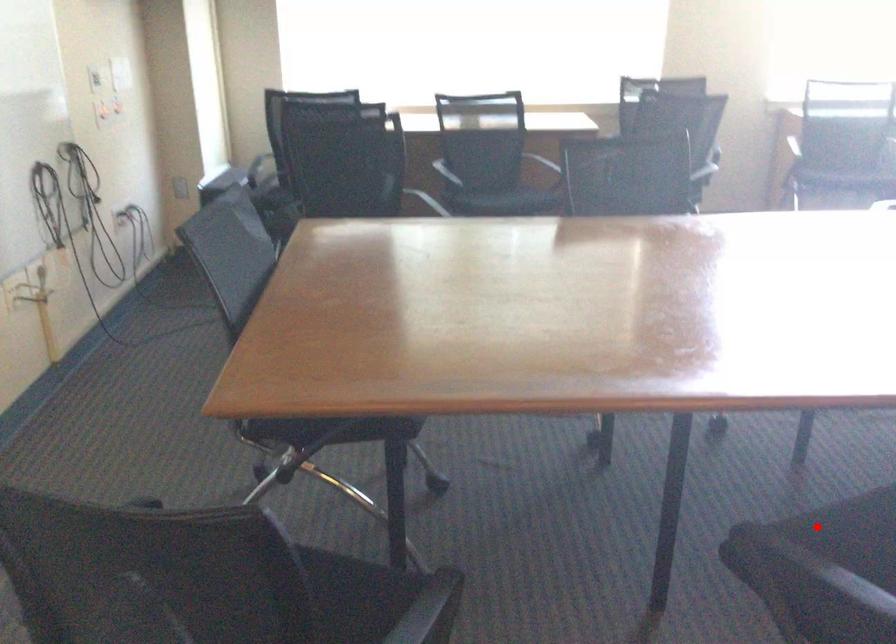
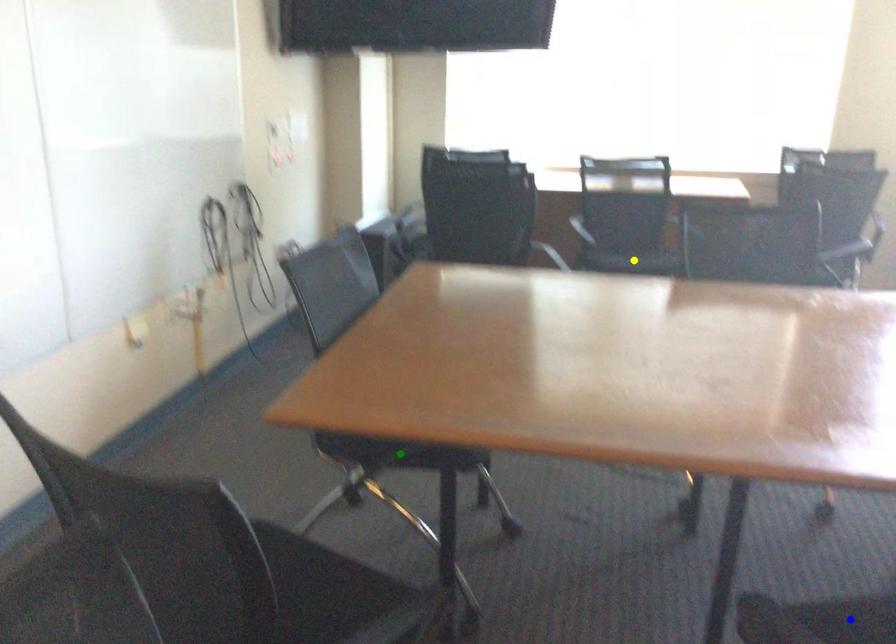
Question: I am providing you with two images of the same scene from different viewpoints. A red point is marked on the first image. You are given multiple points on the second image. In image 2, which mark is for the same physical point as the one in image 1?

Choices:
 (A) yellow point
 (B) blue point
 (C) green point

Answer: (B)